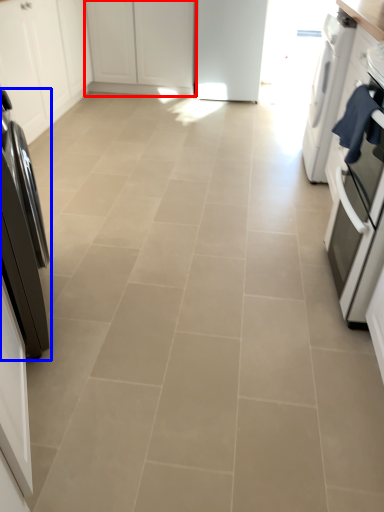
Question: Which of the following is the farthest to the observer, cabinetry (highlighted by a red box) or home appliance (highlighted by a blue box)?

Choices:
 (A) cabinetry
 (B) home appliance

Answer: (A)